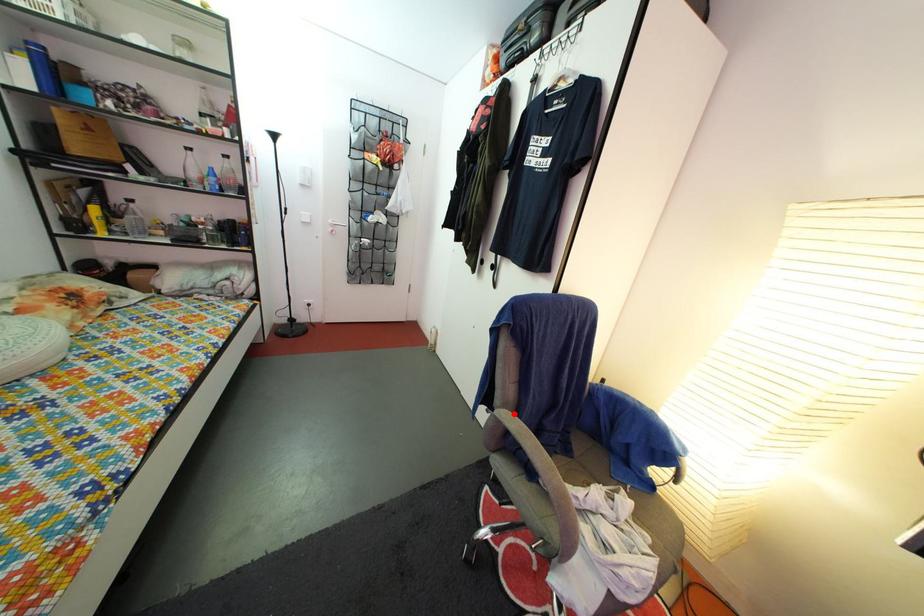
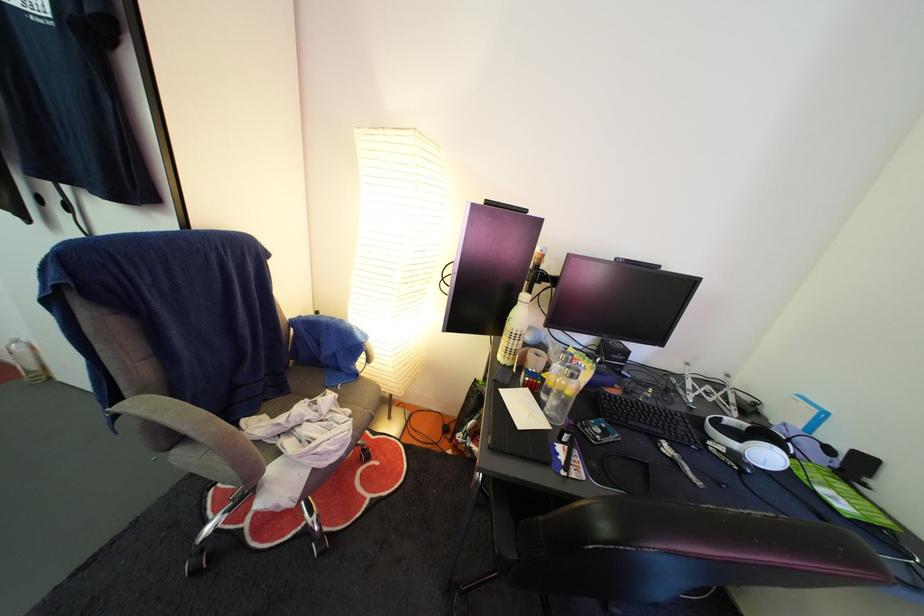
In the second image, find the point that corresponds to the highlighted location in the first image.

(152, 400)